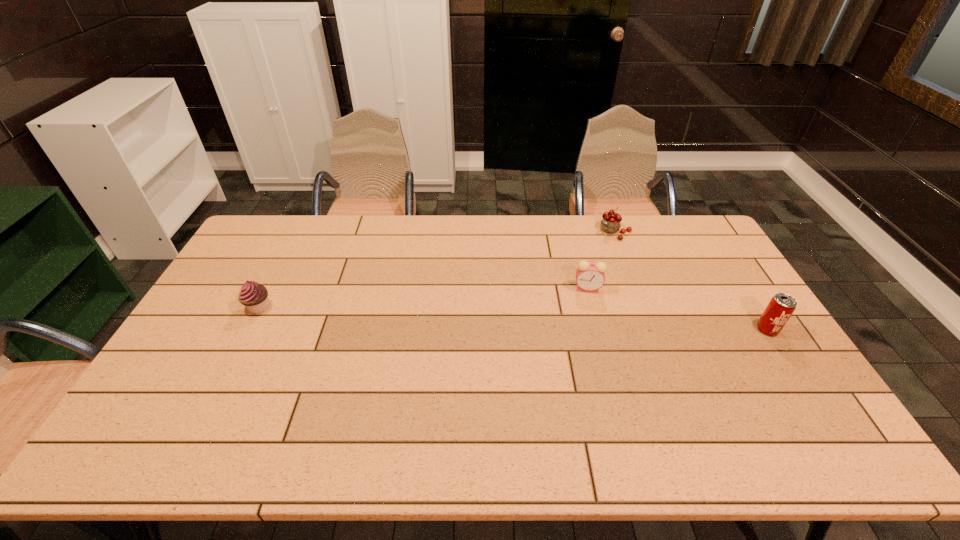
Identify the location of vacant spot on the desktop that is between the second nearest object and the nearest object and is positioned on the handle side of the farthest object. (536, 319).

Where is `vacant space on the desktop that is between the cupcake and the beer can and is positioned on the face of the second object from left to right`? vacant space on the desktop that is between the cupcake and the beer can and is positioned on the face of the second object from left to right is located at coordinates (545, 320).